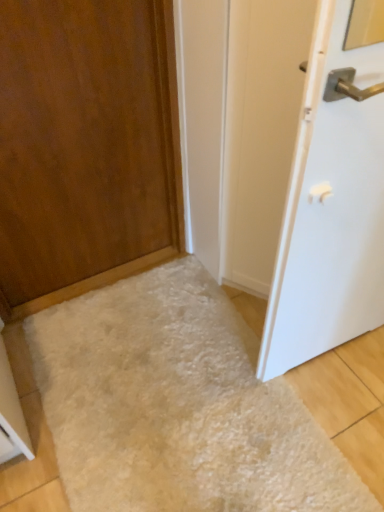
Image resolution: width=384 pixels, height=512 pixels. I want to click on white fluffy rug at lower center, so click(177, 405).

What do you see at coordinates (330, 209) in the screenshot?
I see `white glossy door at right, which is the second door from left to right` at bounding box center [330, 209].

Image resolution: width=384 pixels, height=512 pixels. I want to click on white fluffy rug at lower center, so click(177, 405).

Considering the sizes of wooden door at left, the second door in the right-to-left sequence, and white glossy door at right, positioned as the 1th door in right-to-left order, in the image, is wooden door at left, the second door in the right-to-left sequence, taller or shorter than white glossy door at right, positioned as the 1th door in right-to-left order,?

wooden door at left, the second door in the right-to-left sequence, is shorter than white glossy door at right, positioned as the 1th door in right-to-left order.

Based on the photo, from a real-world perspective, who is located higher, wooden door at left, the second door in the right-to-left sequence, or white glossy door at right, positioned as the 1th door in right-to-left order?

From a 3D spatial view, white glossy door at right, positioned as the 1th door in right-to-left order, is above.

Is wooden door at left, the first door in the left-to-right sequence, far away from white glossy door at right, positioned as the 1th door in right-to-left order?

No.

Does point (84, 481) come closer to viewer compared to point (339, 185)?

No, it is behind (339, 185).

Between white fluffy rug at lower center and white glossy door at right, which is the second door from left to right, which one appears on the right side from the viewer's perspective?

white glossy door at right, which is the second door from left to right.

Is white fluffy rug at lower center spatially inside white glossy door at right, positioned as the 1th door in right-to-left order, or outside of it?

white fluffy rug at lower center lies outside white glossy door at right, positioned as the 1th door in right-to-left order.

Locate an element on the screen. flour that is on the right side of wooden door at left, the first door in the left-to-right sequence is located at coordinates (177, 405).

Looking at this image, from a real-world perspective, which object rests below the other?

white fluffy rug at lower center, from a real-world perspective.

Is white fluffy rug at lower center wider or thinner than wooden door at left, the second door in the right-to-left sequence?

Considering their sizes, white fluffy rug at lower center looks broader than wooden door at left, the second door in the right-to-left sequence.

Considering their positions, is white fluffy rug at lower center located in front of or behind wooden door at left, the first door in the left-to-right sequence?

white fluffy rug at lower center is positioned farther from the viewer than wooden door at left, the first door in the left-to-right sequence.

Which of these two, white glossy door at right, which is the second door from left to right, or white fluffy rug at lower center, stands shorter?

white fluffy rug at lower center is shorter.

Can you confirm if white glossy door at right, which is the second door from left to right, is wider than white fluffy rug at lower center?

In fact, white glossy door at right, which is the second door from left to right, might be narrower than white fluffy rug at lower center.

Which is more to the right, white glossy door at right, which is the second door from left to right, or white fluffy rug at lower center?

Positioned to the right is white glossy door at right, which is the second door from left to right.

Considering the positions of objects white glossy door at right, positioned as the 1th door in right-to-left order, and white fluffy rug at lower center in the image provided, who is in front, white glossy door at right, positioned as the 1th door in right-to-left order, or white fluffy rug at lower center?

white glossy door at right, positioned as the 1th door in right-to-left order, is in front.

Does wooden door at left, the second door in the right-to-left sequence, have a larger size compared to white fluffy rug at lower center?

Yes, wooden door at left, the second door in the right-to-left sequence, is bigger than white fluffy rug at lower center.

Which is in front, wooden door at left, the second door in the right-to-left sequence, or white fluffy rug at lower center?

Positioned in front is wooden door at left, the second door in the right-to-left sequence.

Does point (139, 148) come farther from viewer compared to point (126, 384)?

Yes, it is.

Consider the image. Is wooden door at left, the first door in the left-to-right sequence, turned away from white fluffy rug at lower center?

No, wooden door at left, the first door in the left-to-right sequence, is not facing away from white fluffy rug at lower center.

Considering the relative sizes of white glossy door at right, positioned as the 1th door in right-to-left order, and wooden door at left, the second door in the right-to-left sequence, in the image provided, is white glossy door at right, positioned as the 1th door in right-to-left order, smaller than wooden door at left, the second door in the right-to-left sequence,?

No.

Between point (312, 77) and point (168, 8), which one is positioned behind?

Positioned behind is point (168, 8).

Is white glossy door at right, which is the second door from left to right, oriented away from wooden door at left, the first door in the left-to-right sequence?

No, wooden door at left, the first door in the left-to-right sequence, is not at the back of white glossy door at right, which is the second door from left to right.

Considering the sizes of objects white glossy door at right, which is the second door from left to right, and wooden door at left, the first door in the left-to-right sequence, in the image provided, who is taller, white glossy door at right, which is the second door from left to right, or wooden door at left, the first door in the left-to-right sequence,?

white glossy door at right, which is the second door from left to right, is taller.

This screenshot has width=384, height=512. I want to click on door that appears behind the white glossy door at right, which is the second door from left to right, so click(86, 147).

The width and height of the screenshot is (384, 512). There is a white fluffy rug at lower center. What are the coordinates of `the 2nd door above it (from a real-world perspective)` in the screenshot? It's located at (330, 209).

When comparing their distances from wooden door at left, the second door in the right-to-left sequence, does white glossy door at right, positioned as the 1th door in right-to-left order, or white fluffy rug at lower center seem further?

Based on the image, white glossy door at right, positioned as the 1th door in right-to-left order, appears to be further to wooden door at left, the second door in the right-to-left sequence.

When comparing their distances from white glossy door at right, positioned as the 1th door in right-to-left order, does wooden door at left, the first door in the left-to-right sequence, or white fluffy rug at lower center seem closer?

white fluffy rug at lower center lies closer to white glossy door at right, positioned as the 1th door in right-to-left order, than the other object.

Based on their spatial positions, is white fluffy rug at lower center or wooden door at left, the first door in the left-to-right sequence, closer to white glossy door at right, positioned as the 1th door in right-to-left order?

Among the two, white fluffy rug at lower center is located nearer to white glossy door at right, positioned as the 1th door in right-to-left order.

Which object lies nearer to the anchor point white fluffy rug at lower center, wooden door at left, the second door in the right-to-left sequence, or white glossy door at right, positioned as the 1th door in right-to-left order?

white glossy door at right, positioned as the 1th door in right-to-left order.

When comparing their distances from white fluffy rug at lower center, does white glossy door at right, positioned as the 1th door in right-to-left order, or wooden door at left, the first door in the left-to-right sequence, seem further?

wooden door at left, the first door in the left-to-right sequence, is positioned further to the anchor white fluffy rug at lower center.

When comparing their distances from wooden door at left, the second door in the right-to-left sequence, does white fluffy rug at lower center or white glossy door at right, positioned as the 1th door in right-to-left order, seem further?

white glossy door at right, positioned as the 1th door in right-to-left order, is further to wooden door at left, the second door in the right-to-left sequence.

Locate an element on the screen. The height and width of the screenshot is (512, 384). flour between wooden door at left, the first door in the left-to-right sequence, and white glossy door at right, which is the second door from left to right, in the horizontal direction is located at coordinates (x=177, y=405).